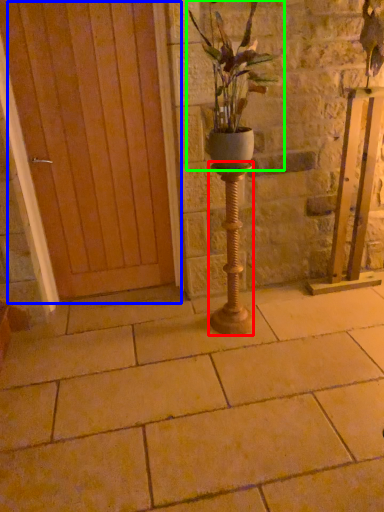
Question: Which object is positioned closest to candle holder (highlighted by a red box)? Select from door (highlighted by a blue box) and houseplant (highlighted by a green box).

Choices:
 (A) door
 (B) houseplant

Answer: (B)